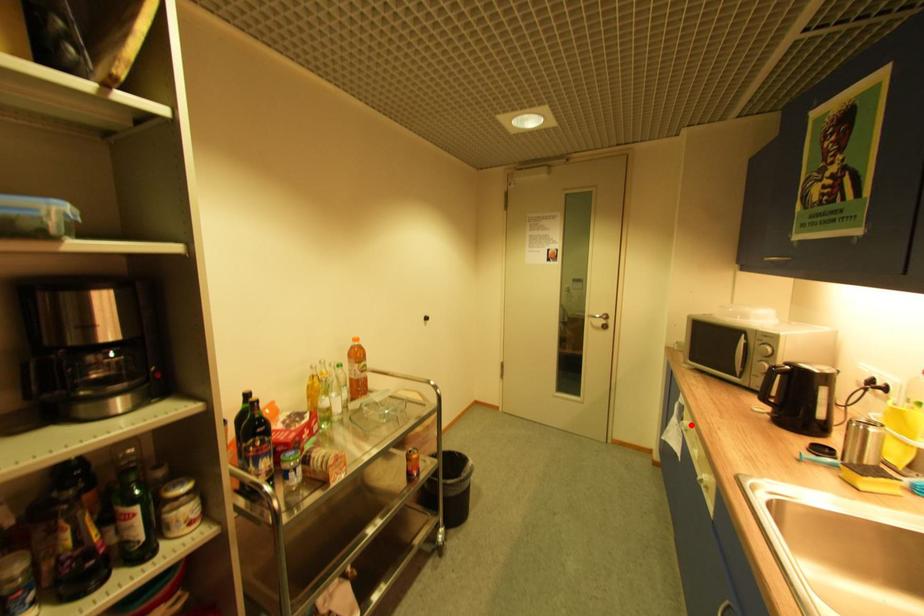
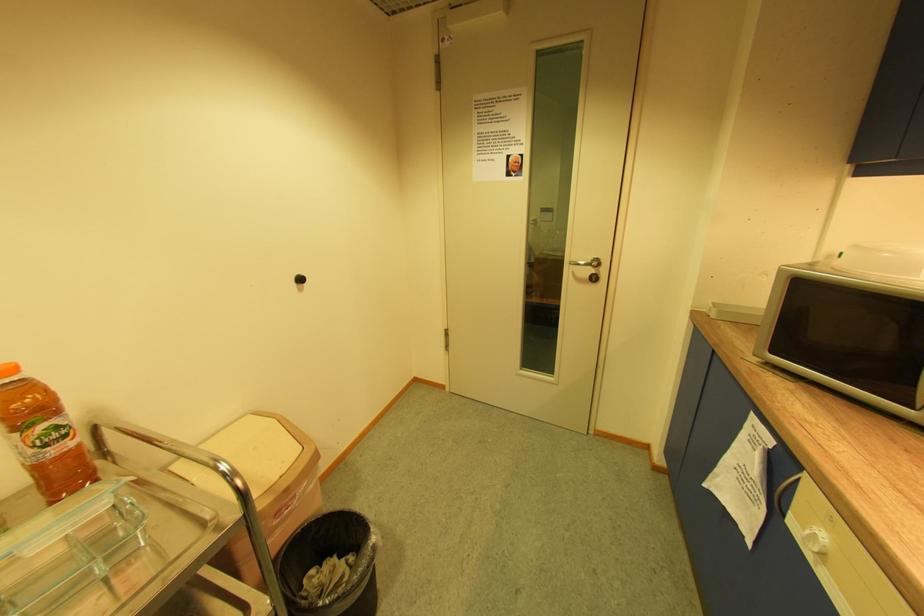
Question: I am providing you with two images of the same scene from different viewpoints. Image1 has a red point marked. In image2, the corresponding 3D location appears at what relative position? Reply with the corresponding letter.

Choices:
 (A) Closer
 (B) Farther

Answer: (B)